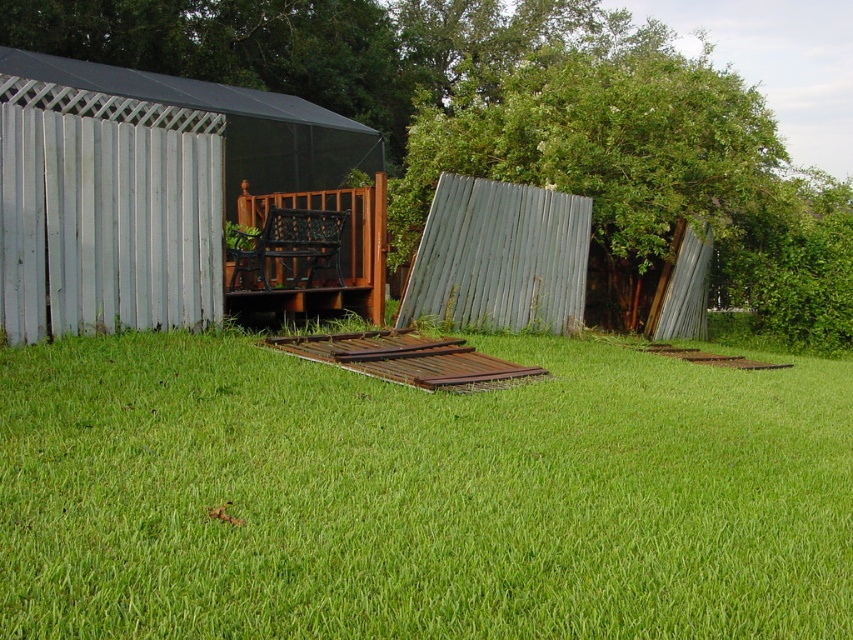
Question: Observing the image, what is the correct spatial positioning of metallic corrugated hut at left in reference to green corrugated metal at upper right?

Choices:
 (A) right
 (B) left

Answer: (B)

Question: Can you confirm if green grass at center is wider than metallic corrugated hut at left?

Choices:
 (A) no
 (B) yes

Answer: (A)

Question: Is the position of metallic corrugated hut at left more distant than that of green corrugated metal at upper right?

Choices:
 (A) yes
 (B) no

Answer: (B)

Question: Which object is farther from the camera taking this photo?

Choices:
 (A) green grass at center
 (B) metallic corrugated hut at left
 (C) green corrugated metal at upper right

Answer: (C)

Question: Which object is closer to the camera taking this photo?

Choices:
 (A) green corrugated metal at upper right
 (B) green grass at center

Answer: (B)

Question: Which of the following is the farthest from the observer?

Choices:
 (A) metallic corrugated hut at left
 (B) green corrugated metal at upper right
 (C) green grass at center

Answer: (B)